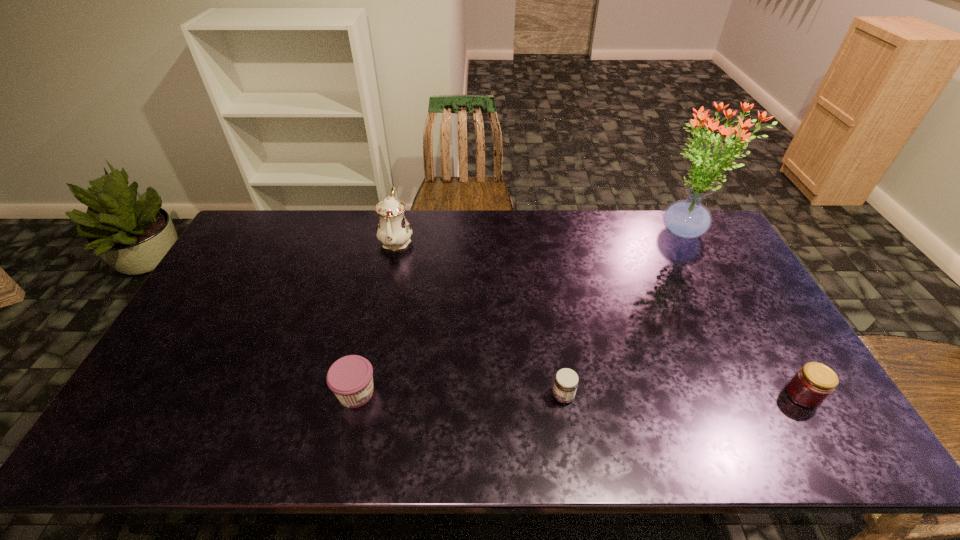
Identify the location of vacant space located on the front label of the third object from right to left. The image size is (960, 540). (468, 396).

Where is `free space located 0.360m on the front label of the third object from right to left`? free space located 0.360m on the front label of the third object from right to left is located at coordinates (409, 396).

Where is `flower arrangement located in the far edge section of the desktop`? flower arrangement located in the far edge section of the desktop is located at coordinates (687, 219).

Locate an element on the screen. chinaware positioned at the far edge is located at coordinates (394, 231).

The height and width of the screenshot is (540, 960). I want to click on flower arrangement situated at the right edge, so click(687, 219).

This screenshot has width=960, height=540. Find the location of `jam located at the right edge`. jam located at the right edge is located at coordinates (813, 383).

What are the coordinates of `object present at the far right corner` in the screenshot? It's located at (687, 219).

Where is `free space at the far edge of the desktop`? This screenshot has height=540, width=960. free space at the far edge of the desktop is located at coordinates (348, 252).

Locate an element on the screen. free space at the near edge of the desktop is located at coordinates (201, 428).

Where is `blank space at the left edge of the desktop`? The image size is (960, 540). blank space at the left edge of the desktop is located at coordinates point(217,280).